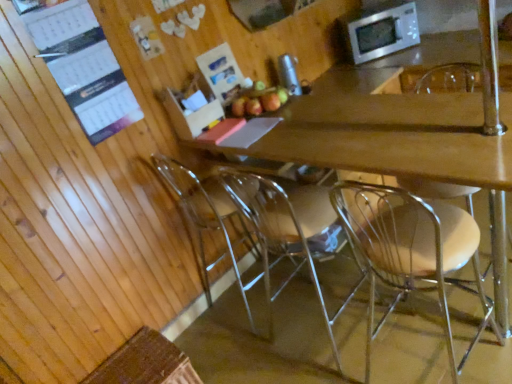
Question: Is clear plastic chair at center, which is the 4th chair from left to right, in front of or behind wooden desk at center in the image?

Choices:
 (A) front
 (B) behind

Answer: (B)

Question: Is clear plastic chair at center, which is the 4th chair from left to right, wider or thinner than wooden desk at center?

Choices:
 (A) thin
 (B) wide

Answer: (A)

Question: Considering the real-world distances, which object is closest to the clear plastic chair at lower center, which appears as the first chair when viewed from the left?

Choices:
 (A) white paper calendar at upper left
 (B) clear plastic chair at center, which is the 4th chair from left to right
 (C) clear plastic chair at center, the second chair in the right-to-left sequence
 (D) stainless steel microwave at upper right
 (E) red matte apple at center

Answer: (E)

Question: Which object is positioned farthest from the white paper calendar at upper left?

Choices:
 (A) clear plastic chair at lower center, the 4th chair when ordered from right to left
 (B) red matte apple at center
 (C) stainless steel microwave at upper right
 (D) clear plastic chair at center, the 1th chair from the right
 (E) clear plastic chair at center, arranged as the 3th chair when viewed from the left

Answer: (D)